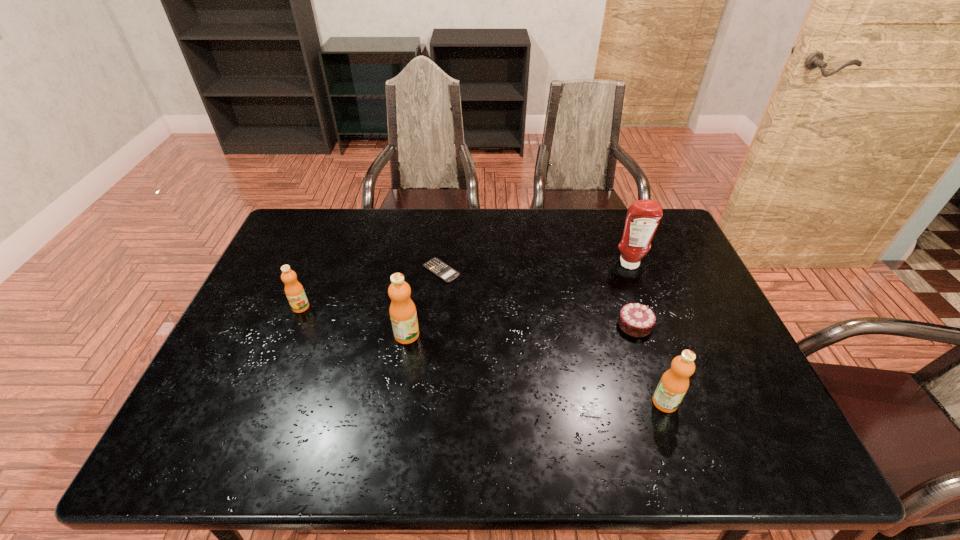
Select which object is the second closest to the condiment. Please provide its 2D coordinates. Your answer should be formatted as a tuple, i.e. [(x, y)], where the tuple contains the x and y coordinates of a point satisfying the conditions above.

[(674, 383)]

At what (x,y) coordinates should I click in order to perform the action: click on orange juice identified as the third closest to the condiment. Please return your answer as a coordinate pair (x, y). This screenshot has height=540, width=960. Looking at the image, I should click on (294, 291).

Find the location of a particular element. orange juice that is the third closest to the calculator is located at coordinates (674, 383).

This screenshot has height=540, width=960. In order to click on vacant position in the image that satisfies the following two spatial constraints: 1. on the front side of the chocolate cake; 2. on the front label of the second nearest orange juice in this screenshot , I will do `click(638, 335)`.